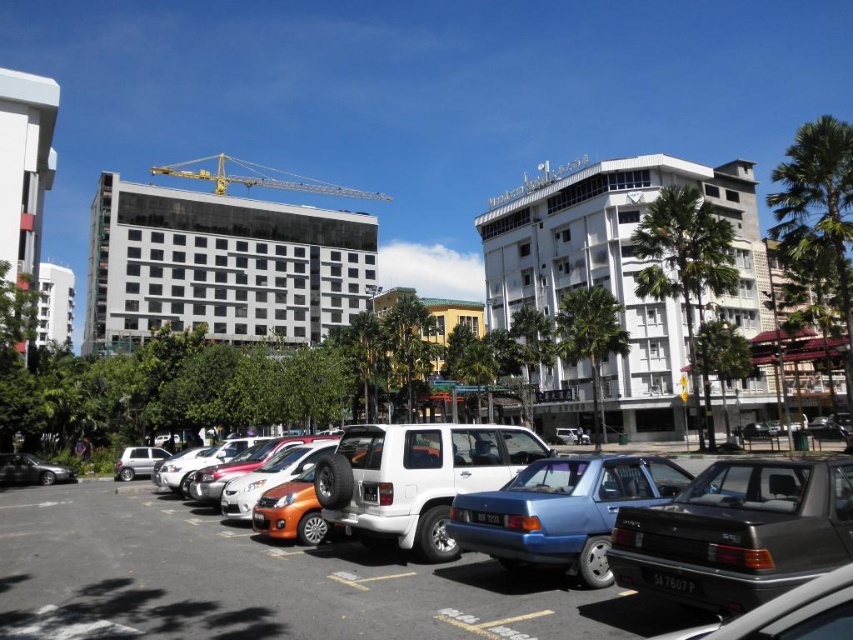
Question: Is yellow metallic crane at upper center to the left of shiny silver car at lower left from the viewer's perspective?

Choices:
 (A) no
 (B) yes

Answer: (B)

Question: Which object appears closest to the camera in this image?

Choices:
 (A) shiny silver car at lower left
 (B) yellow metallic crane at upper center
 (C) metallic blue sedan at center

Answer: (C)

Question: Can you confirm if dark gray metallic sedan at center right is positioned above yellow metallic crane at upper center?

Choices:
 (A) no
 (B) yes

Answer: (A)

Question: Is metallic blue sedan at center thinner than white glossy building at upper left?

Choices:
 (A) no
 (B) yes

Answer: (B)

Question: Which of the following is the farthest from the observer?

Choices:
 (A) (97, 353)
 (B) (32, 483)
 (C) (635, 536)
 (D) (465, 525)

Answer: (A)

Question: Which object appears farthest from the camera in this image?

Choices:
 (A) glassy reflective building at center
 (B) metallic blue sedan at center

Answer: (A)